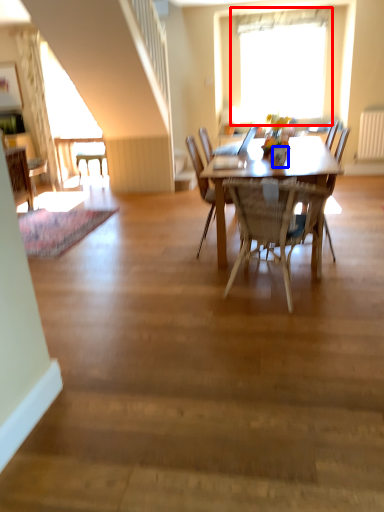
Question: Which point is closer to the camera, window (highlighted by a red box) or vase (highlighted by a blue box)?

Choices:
 (A) window
 (B) vase

Answer: (B)